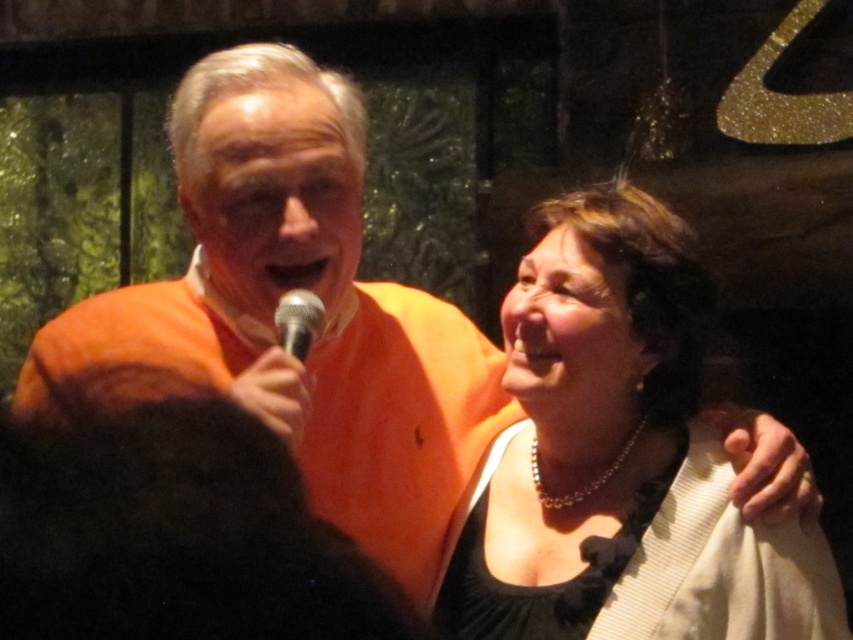
Question: Can you confirm if matte black dress at center is positioned below silver metallic microphone at center?

Choices:
 (A) no
 (B) yes

Answer: (B)

Question: Can you confirm if matte black dress at center is positioned above silver metallic microphone at center?

Choices:
 (A) no
 (B) yes

Answer: (A)

Question: Does matte black dress at center appear under silver metallic microphone at center?

Choices:
 (A) yes
 (B) no

Answer: (A)

Question: Among these objects, which one is farthest from the camera?

Choices:
 (A) matte black dress at center
 (B) silver metallic microphone at center

Answer: (B)

Question: Which of the following is the farthest from the observer?

Choices:
 (A) silver metallic microphone at center
 (B) matte black dress at center

Answer: (A)

Question: Which of the following is the farthest from the observer?

Choices:
 (A) matte black dress at center
 (B) silver metallic microphone at center

Answer: (B)